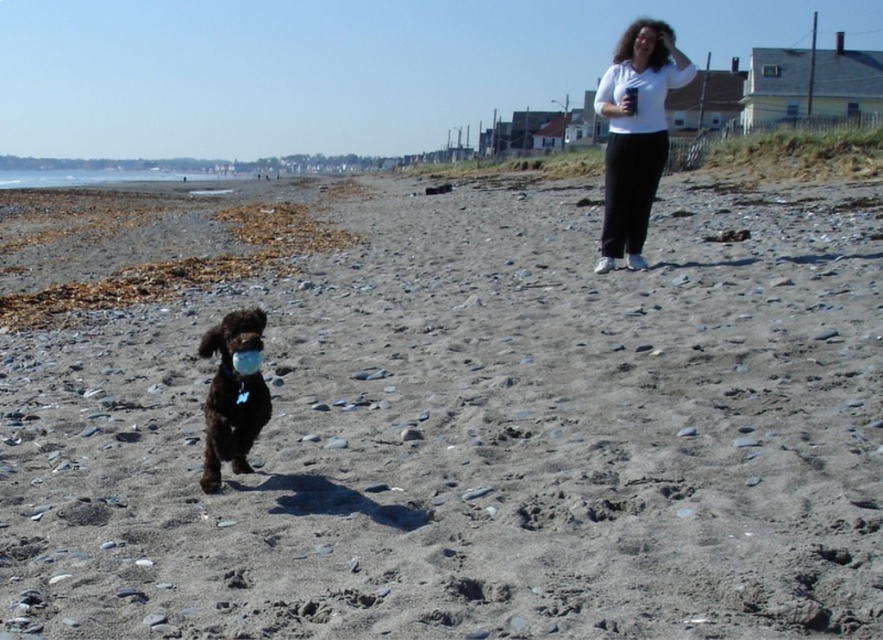
Question: Which point appears farthest from the camera in this image?

Choices:
 (A) (224, 419)
 (B) (651, 109)

Answer: (B)

Question: Estimate the real-world distances between objects in this image. Which object is closer to the white cotton shirt at upper right?

Choices:
 (A) shiny brown dog at center
 (B) gray gravelly sand at center
 (C) matte white mouth at upper center

Answer: (C)

Question: Can you confirm if gray gravelly sand at center is smaller than white cotton shirt at upper right?

Choices:
 (A) yes
 (B) no

Answer: (B)

Question: Does white cotton shirt at upper right appear over shiny brown dog at center?

Choices:
 (A) no
 (B) yes

Answer: (B)

Question: Is gray gravelly sand at center smaller than white cotton shirt at upper right?

Choices:
 (A) yes
 (B) no

Answer: (B)

Question: Considering the real-world distances, which object is closest to the white cotton shirt at upper right?

Choices:
 (A) gray gravelly sand at center
 (B) matte white mouth at upper center
 (C) shiny brown dog at center

Answer: (B)